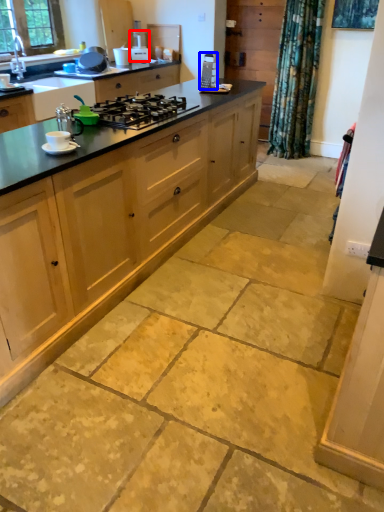
Question: Which object is further to the camera taking this photo, kitchen appliance (highlighted by a red box) or appliance (highlighted by a blue box)?

Choices:
 (A) kitchen appliance
 (B) appliance

Answer: (A)